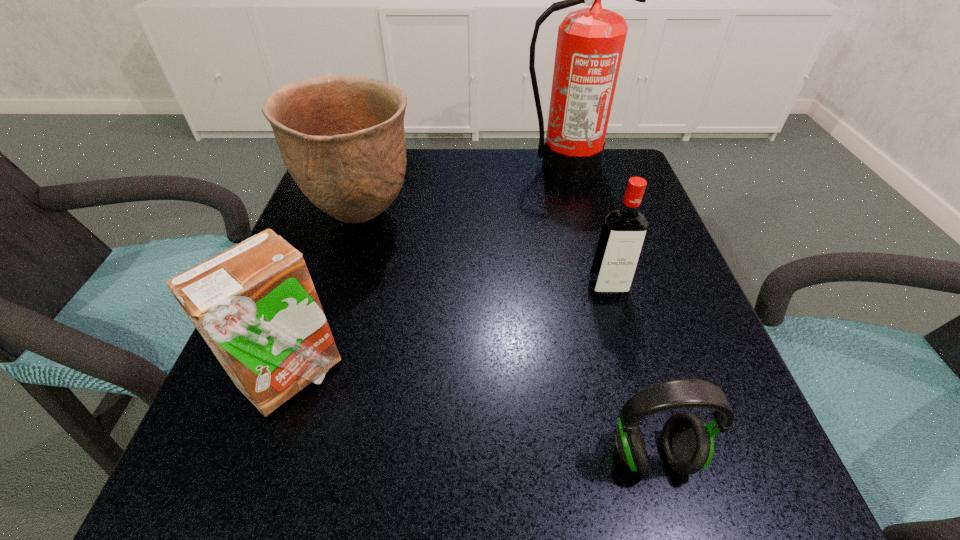
This screenshot has width=960, height=540. Find the location of `fire extinguisher`. fire extinguisher is located at coordinates (590, 42).

Where is `the tallest object`? The width and height of the screenshot is (960, 540). the tallest object is located at coordinates (590, 42).

Identify the location of pottery. This screenshot has height=540, width=960. (342, 139).

Where is `vodka`? The image size is (960, 540). vodka is located at coordinates 623,232.

This screenshot has width=960, height=540. In order to click on carton in this screenshot , I will do `click(255, 305)`.

Identify the location of the nearest object. This screenshot has width=960, height=540. (687, 444).

Where is `the shortest object`? This screenshot has height=540, width=960. the shortest object is located at coordinates (687, 444).

Where is `vacant space located 0.070m on the front side of the tallest object`? Image resolution: width=960 pixels, height=540 pixels. vacant space located 0.070m on the front side of the tallest object is located at coordinates (574, 198).

The image size is (960, 540). Find the location of `free space located 0.400m on the right of the pottery`. free space located 0.400m on the right of the pottery is located at coordinates (612, 218).

This screenshot has width=960, height=540. What are the coordinates of `free space located 0.280m on the front and back of the third nearest object` in the screenshot? It's located at (656, 462).